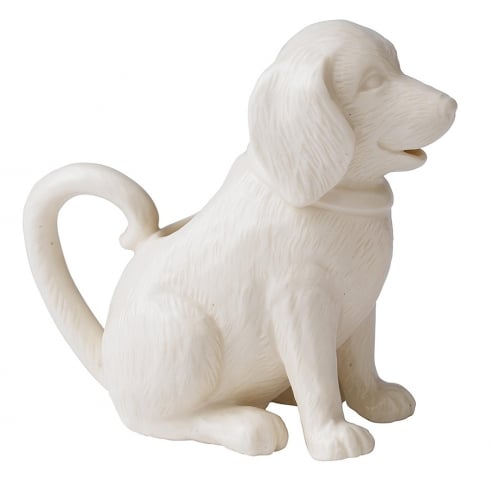
Locate an element on the screen. The height and width of the screenshot is (490, 490). handle is located at coordinates (62, 315), (143, 209).